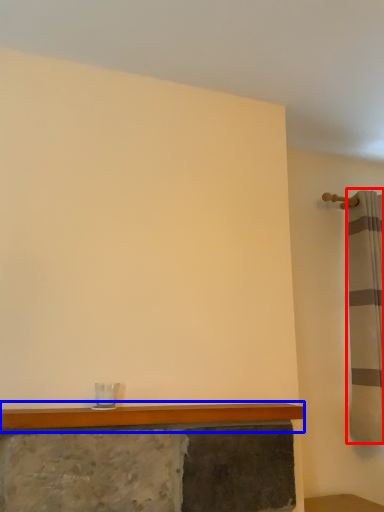
Question: Which of the following is the farthest to the observer, shower curtain (highlighted by a red box) or counter top (highlighted by a blue box)?

Choices:
 (A) shower curtain
 (B) counter top

Answer: (A)